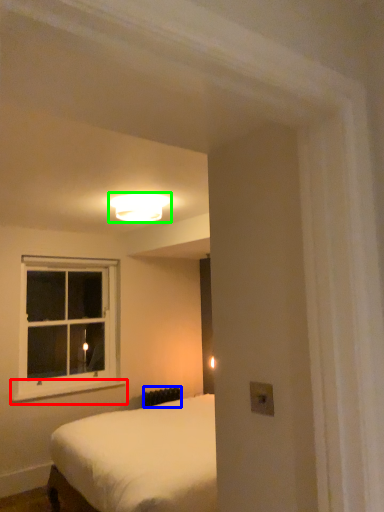
Question: Which is farther away from window sill (highlighted by a red box)? radiator (highlighted by a blue box) or lamp (highlighted by a green box)?

Choices:
 (A) radiator
 (B) lamp

Answer: (B)